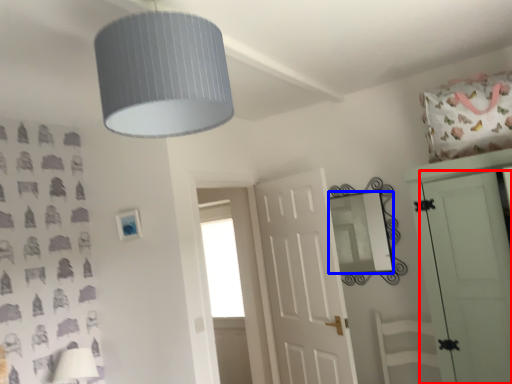
Question: Among these objects, which one is nearest to the camera, door (highlighted by a red box) or mirror (highlighted by a blue box)?

Choices:
 (A) door
 (B) mirror

Answer: (A)